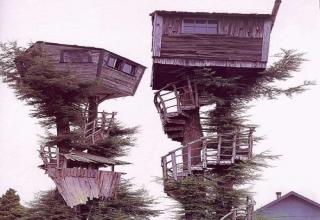
Identify the location of chimney. (277, 192).